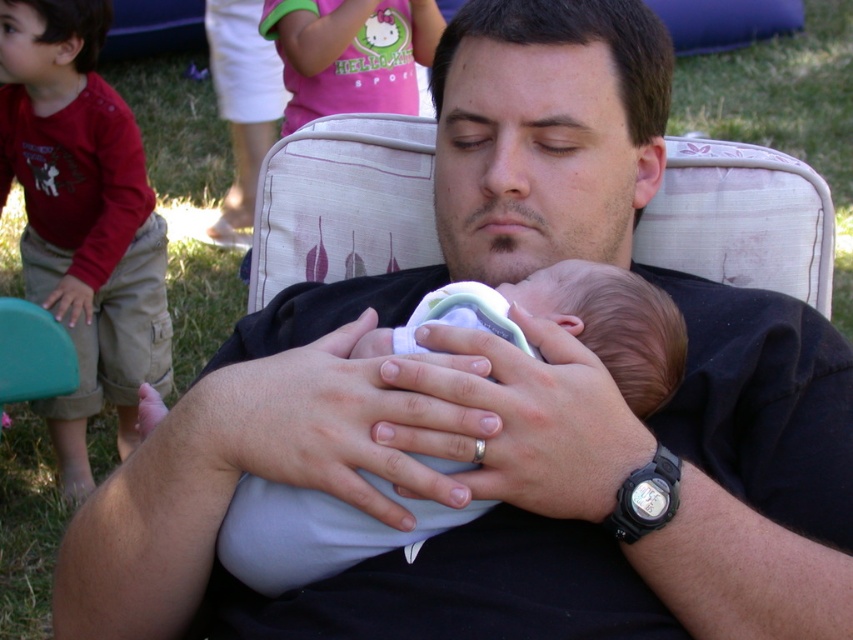
Question: Is red cotton shirt at left further to the viewer compared to pink cotton shirt at upper center?

Choices:
 (A) no
 (B) yes

Answer: (A)

Question: Estimate the real-world distances between objects in this image. Which object is farther from the light blue fabric baby at center?

Choices:
 (A) red cotton shirt at left
 (B) pink cotton shirt at upper center

Answer: (B)

Question: Does light blue fabric baby at center appear on the left side of pink cotton shirt at upper center?

Choices:
 (A) no
 (B) yes

Answer: (A)

Question: Considering the real-world distances, which object is farthest from the light blue fabric baby at center?

Choices:
 (A) pink cotton shirt at upper center
 (B) red cotton shirt at left

Answer: (A)

Question: Observing the image, what is the correct spatial positioning of red cotton shirt at left in reference to pink cotton shirt at upper center?

Choices:
 (A) below
 (B) above

Answer: (A)

Question: Which point appears farthest from the camera in this image?

Choices:
 (A) (88, 321)
 (B) (349, 77)

Answer: (B)